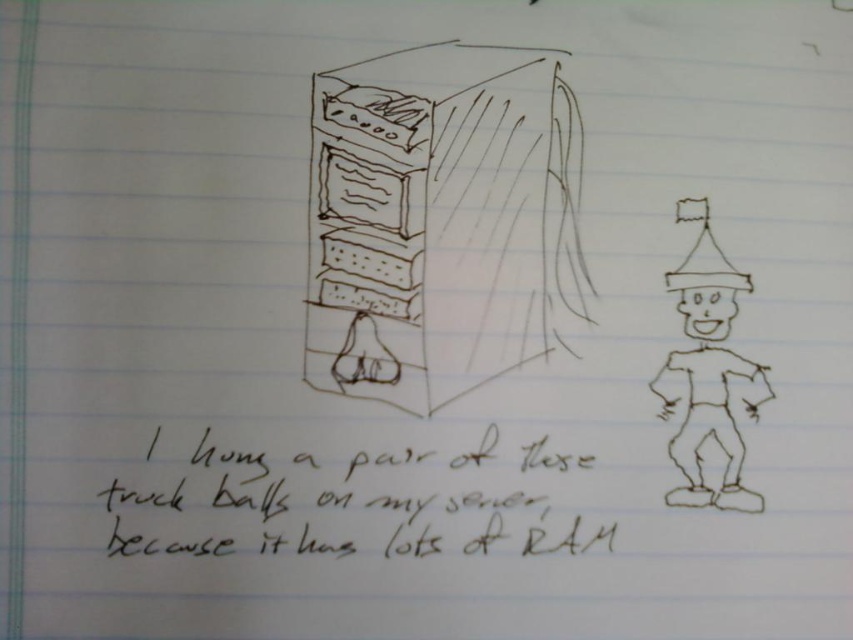
Does matte black server at center appear on the right side of black ink handwriting at center?

Indeed, matte black server at center is positioned on the right side of black ink handwriting at center.

What do you see at coordinates (440, 220) in the screenshot? The height and width of the screenshot is (640, 853). I see `matte black server at center` at bounding box center [440, 220].

The width and height of the screenshot is (853, 640). Identify the location of matte black server at center. (440, 220).

Between black ink handwriting at center and brown paper man at right, which one has less height?

With less height is black ink handwriting at center.

Between point (408, 540) and point (733, 317), which one is positioned behind?

Point (733, 317)

The height and width of the screenshot is (640, 853). In order to click on black ink handwriting at center in this screenshot , I will do `click(334, 506)`.

Find the location of a particular element. The image size is (853, 640). black ink handwriting at center is located at coordinates (334, 506).

Who is shorter, matte black server at center or brown paper man at right?

With less height is brown paper man at right.

Can you confirm if matte black server at center is wider than brown paper man at right?

Indeed, matte black server at center has a greater width compared to brown paper man at right.

Which is in front, point (490, 122) or point (704, 225)?

Point (490, 122) is in front.

What are the coordinates of `matte black server at center` in the screenshot? It's located at (440, 220).